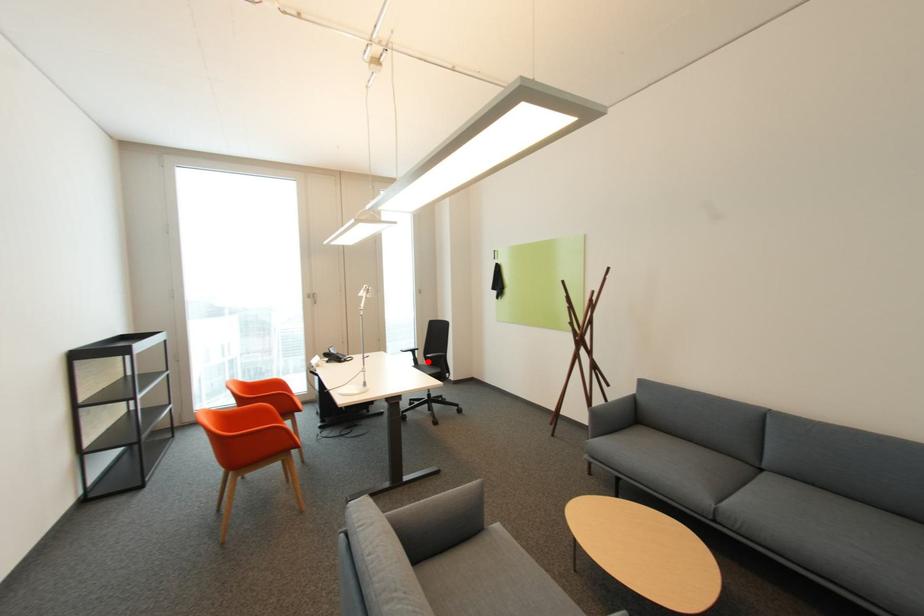
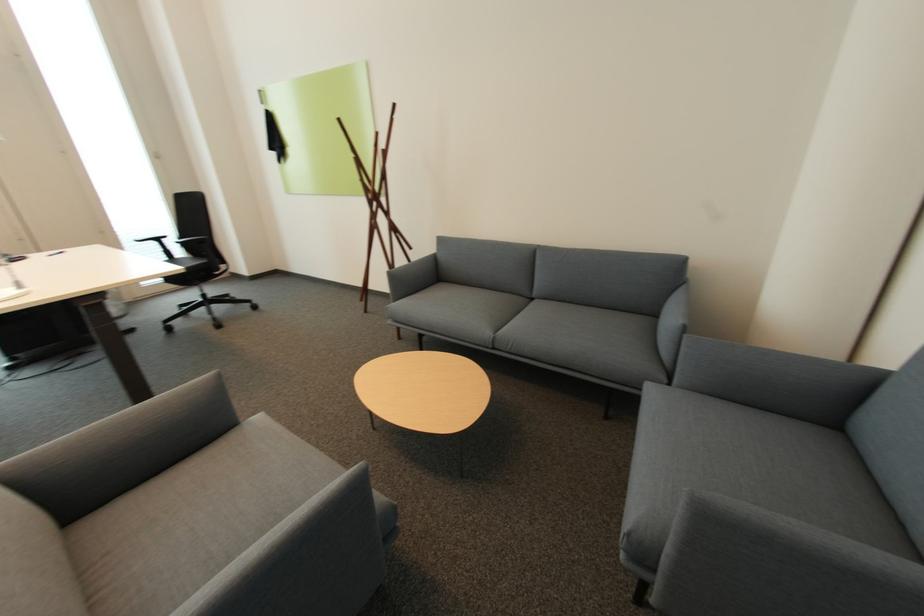
Locate, in the second image, the point that corresponds to the highlighted location in the first image.

(187, 253)